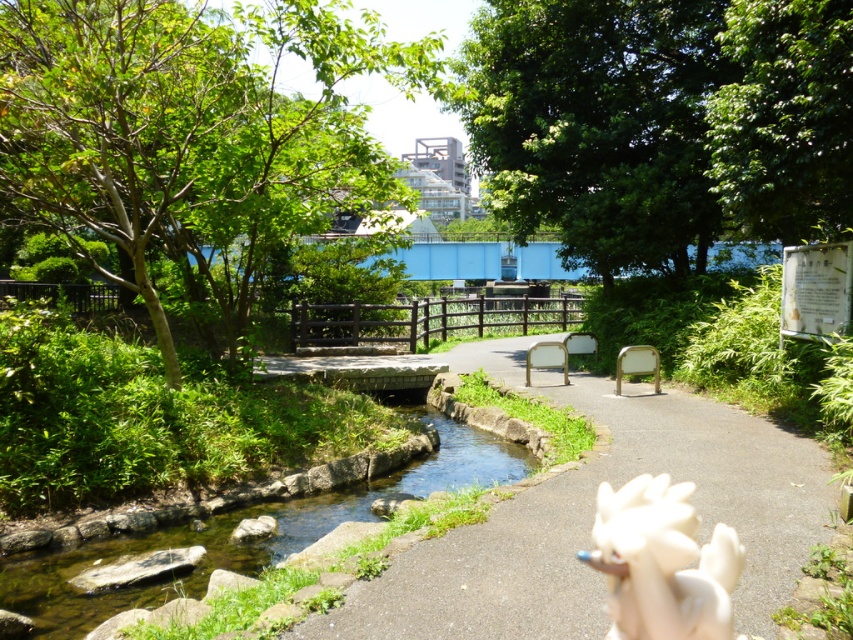
Between green stone stream at center and white matte gloves at lower right, which one is positioned lower?

green stone stream at center

You are a GUI agent. You are given a task and a screenshot of the screen. Output one action in this format:
    pyautogui.click(x=<x>, y=<y>)
    Task: Click on the green stone stream at center
    
    Given the screenshot: What is the action you would take?
    pyautogui.click(x=244, y=541)

The height and width of the screenshot is (640, 853). I want to click on smooth stone path at center, so click(x=592, y=518).

Between point (532, 600) and point (693, 580), which one is positioned in front?

Positioned in front is point (693, 580).

Identify the location of smooth stone path at center. (592, 518).

Can you confirm if smooth stone path at center is thinner than green stone stream at center?

Incorrect, smooth stone path at center's width is not less than green stone stream at center's.

You are a GUI agent. You are given a task and a screenshot of the screen. Output one action in this format:
    pyautogui.click(x=<x>, y=<y>)
    Task: Click on the smooth stone path at center
    This screenshot has height=640, width=853.
    Given the screenshot: What is the action you would take?
    pyautogui.click(x=592, y=518)

Locate an element on the screen. smooth stone path at center is located at coordinates (592, 518).